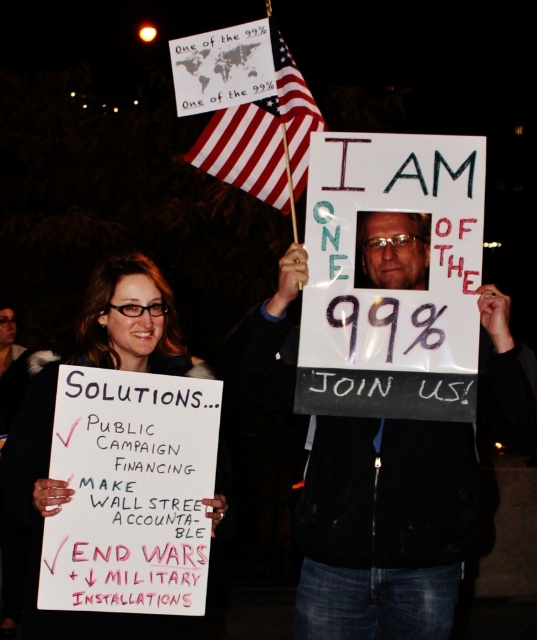
Can you confirm if matte white sign at center is bigger than american flag at upper center?

Yes, matte white sign at center is bigger than american flag at upper center.

Is matte white sign at center behind american flag at upper center?

No, matte white sign at center is closer to the viewer.

What are the coordinates of `matte white sign at center` in the screenshot? It's located at (53, 513).

Does point (266, 358) come in front of point (422, 227)?

That is False.

Who is positioned more to the right, white paper sign at center or clear plastic glasses at upper center?

clear plastic glasses at upper center is more to the right.

Who is more forward, (453,465) or (411,269)?

Positioned in front is point (453,465).

What are the coordinates of `white paper sign at center` in the screenshot? It's located at (384, 528).

Looking at this image, does white paper sign at center appear on the right side of american flag at upper center?

Indeed, white paper sign at center is positioned on the right side of american flag at upper center.

Does point (387, 502) lie in front of point (304, 106)?

Yes, point (387, 502) is in front of point (304, 106).

Where is `white paper sign at center`? The width and height of the screenshot is (537, 640). white paper sign at center is located at coordinates (384, 528).